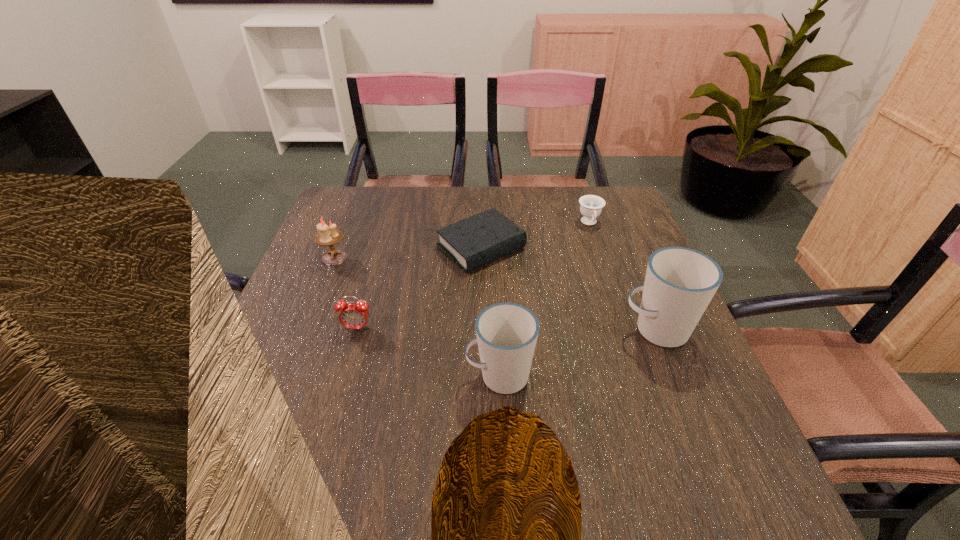
Locate an element on the screen. Image resolution: width=960 pixels, height=540 pixels. the left cup is located at coordinates (507, 333).

Identify the location of the right cup. (680, 282).

Identify the location of the tallest object. (680, 282).

The height and width of the screenshot is (540, 960). What are the coordinates of `Bible` in the screenshot? It's located at (473, 242).

The height and width of the screenshot is (540, 960). Identify the location of teacup. (591, 206).

Identify the location of the leftmost object. This screenshot has width=960, height=540. (328, 236).

Find the location of a particular element. the fifth object from right to left is located at coordinates (352, 315).

Identify the location of alarm clock. (352, 315).

Identify the location of vacant position located 0.060m with a handle on the side of the left cup. This screenshot has width=960, height=540. (436, 376).

The image size is (960, 540). In order to click on vacant point located 0.330m with a handle on the side of the left cup in this screenshot , I will do `click(301, 376)`.